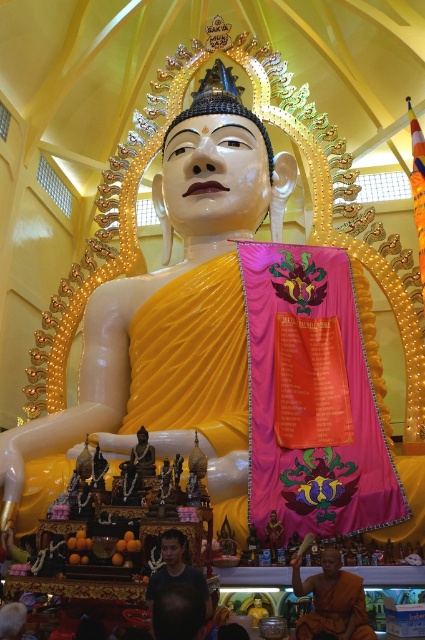
You are a visitor standing at the entrance of the temple. You see the brown cloth monk at lower center. Where is the brown cloth monk located in the temple?

The brown cloth monk at lower center is located at point [331,600] in the temple.

You are a visitor standing at the entrance of the temple. You see the brown cloth monk at lower center and the dark blue shirt at lower center. Which object is closer to you?

The brown cloth monk at lower center is closer to you because it is in front of the dark blue shirt at lower center.

You are a temple visitor standing in front of the seated Buddha statue. You notice two points marked on the wall behind the altar table. One is at coordinate point (x=312, y=579) and the other at point (x=150, y=580). If you want to touch the point closer to you, which coordinate should you aim for?

Point (x=150, y=580) is closer to you than point (x=312, y=579), so you should aim for point (x=150, y=580).